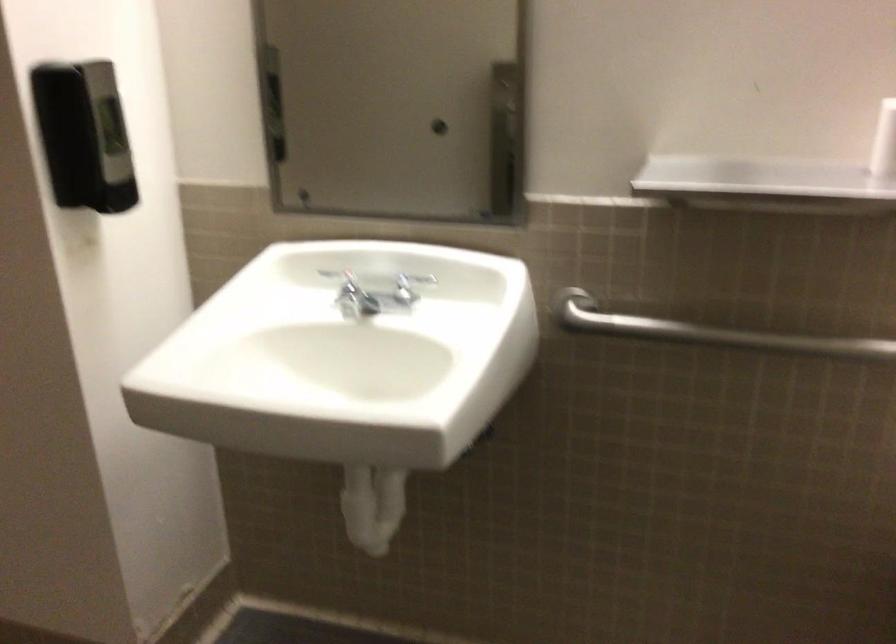
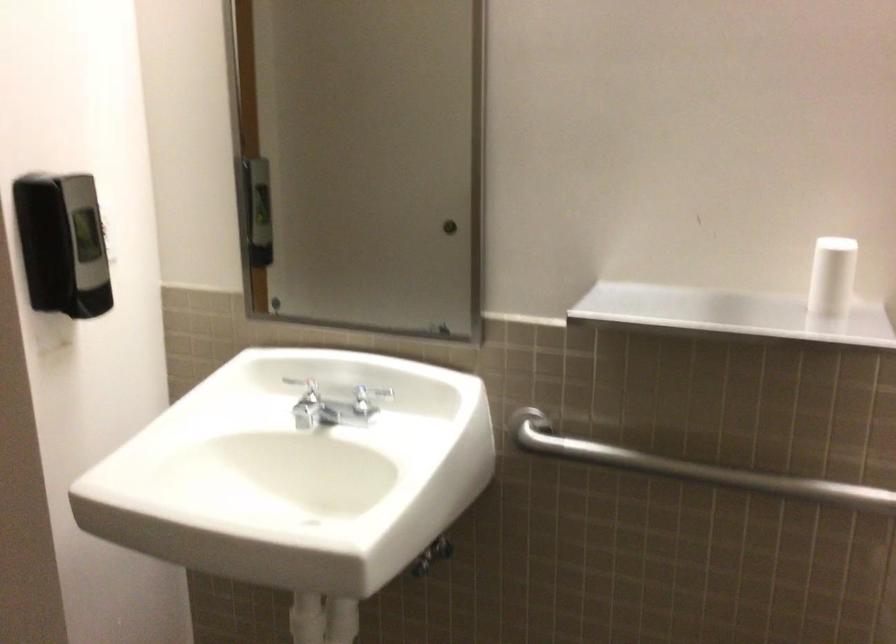
Where in the second image is the point corresponding to (x=408, y=285) from the first image?

(368, 397)